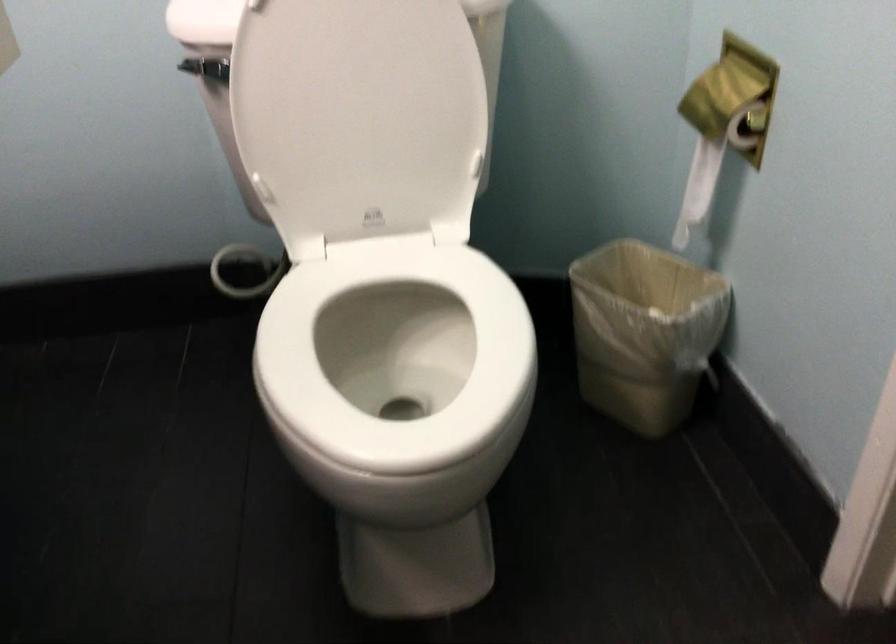
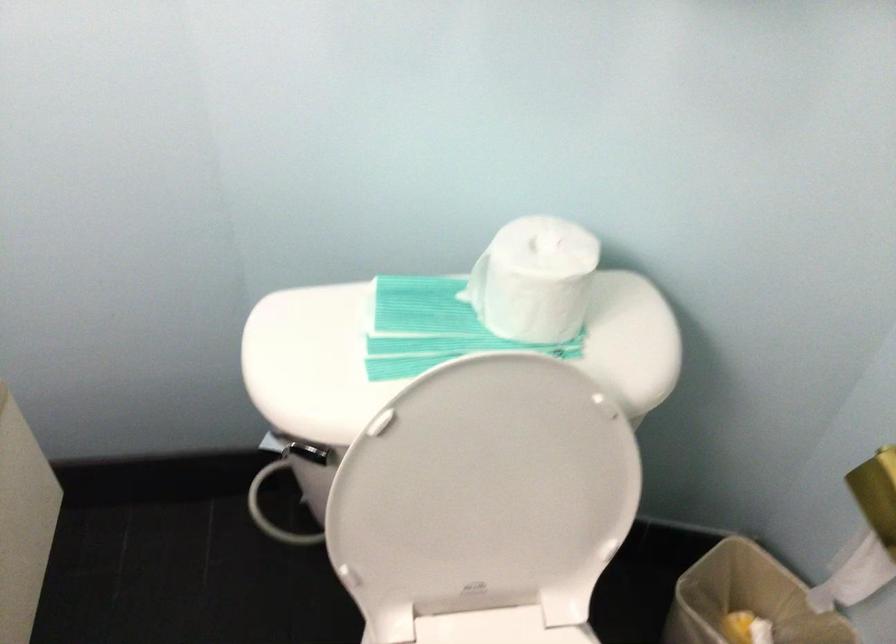
The point at (x=392, y=245) is marked in the first image. Where is the corresponding point in the second image?

(497, 627)